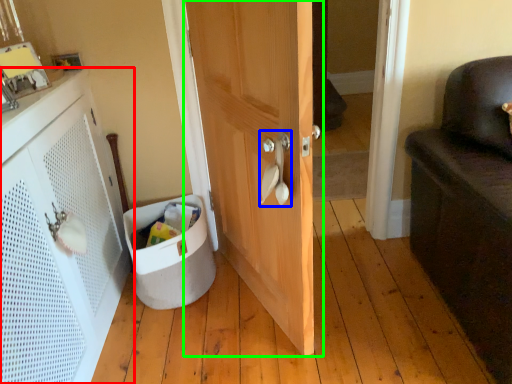
Question: Which object is the farthest from cabinetry (highlighted by a red box)? Choose among these: door handle (highlighted by a blue box) or door (highlighted by a green box).

Choices:
 (A) door handle
 (B) door

Answer: (A)